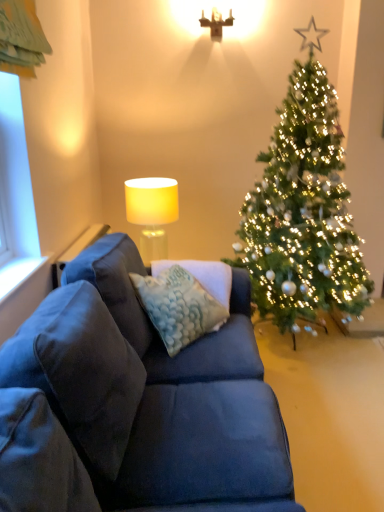
Locate an element on the screen. free spot in front of green textured christmas tree at right is located at coordinates (330, 417).